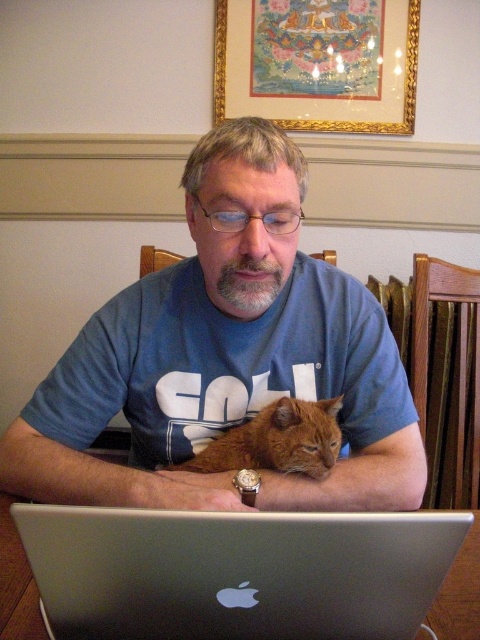
Can you confirm if silver metallic laptop at lower center is shorter than gold-framed artwork at upper center?

Yes, silver metallic laptop at lower center is shorter than gold-framed artwork at upper center.

Does point (137, 515) come behind point (294, 58)?

No, (137, 515) is in front of (294, 58).

Who is more forward, (201, 561) or (396, 77)?

Positioned in front is point (201, 561).

This screenshot has width=480, height=640. I want to click on silver metallic laptop at lower center, so click(x=237, y=572).

Does blue cotton shirt at center lie behind gold-framed artwork at upper center?

No, it is in front of gold-framed artwork at upper center.

Is blue cotton shirt at center taller than gold-framed artwork at upper center?

Indeed, blue cotton shirt at center has a greater height compared to gold-framed artwork at upper center.

Is point (120, 355) positioned in front of point (363, 97)?

Yes, point (120, 355) is closer to viewer.

Identify the location of blue cotton shirt at center. (225, 356).

You are a GUI agent. You are given a task and a screenshot of the screen. Output one action in this format:
    pyautogui.click(x=<x>, y=<y>)
    Task: Click on the blue cotton shirt at center
    
    Given the screenshot: What is the action you would take?
    pyautogui.click(x=225, y=356)

Does point (215, 144) lie in front of point (245, 435)?

Yes.

Locate an element on the screen. This screenshot has height=640, width=480. blue cotton shirt at center is located at coordinates (225, 356).